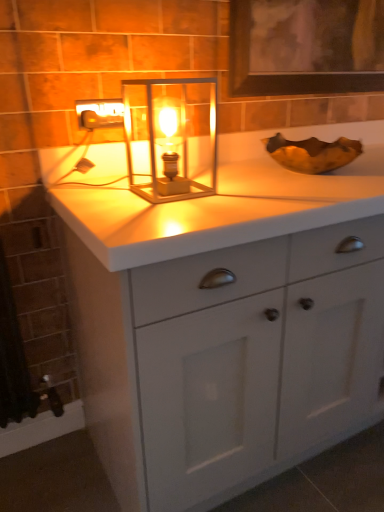
Question: Which is correct: translucent glass lantern at center is inside matte silver outlet at upper left, or outside of it?

Choices:
 (A) outside
 (B) inside

Answer: (A)

Question: Considering the positions of translucent glass lantern at center and matte silver outlet at upper left in the image, is translucent glass lantern at center taller or shorter than matte silver outlet at upper left?

Choices:
 (A) tall
 (B) short

Answer: (A)

Question: Estimate the real-world distances between objects in this image. Which object is closer to the matte silver outlet at upper left?

Choices:
 (A) white matte cabinet at center
 (B) translucent glass lantern at center

Answer: (B)

Question: Which is farther from the white matte cabinet at center?

Choices:
 (A) matte silver outlet at upper left
 (B) translucent glass lantern at center

Answer: (A)